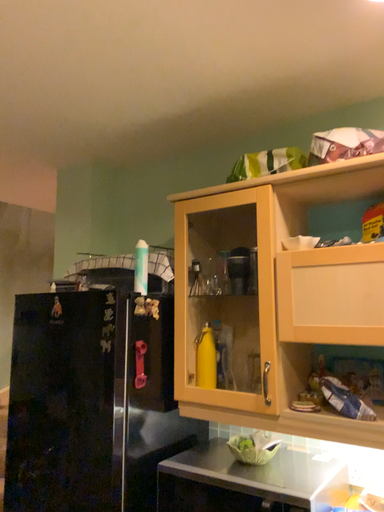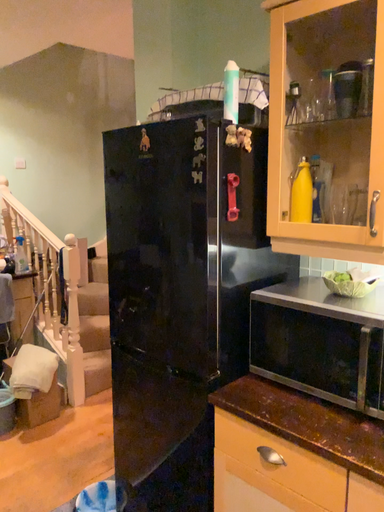
Question: Which way did the camera rotate in the video?

Choices:
 (A) rotated downward
 (B) rotated upward

Answer: (A)